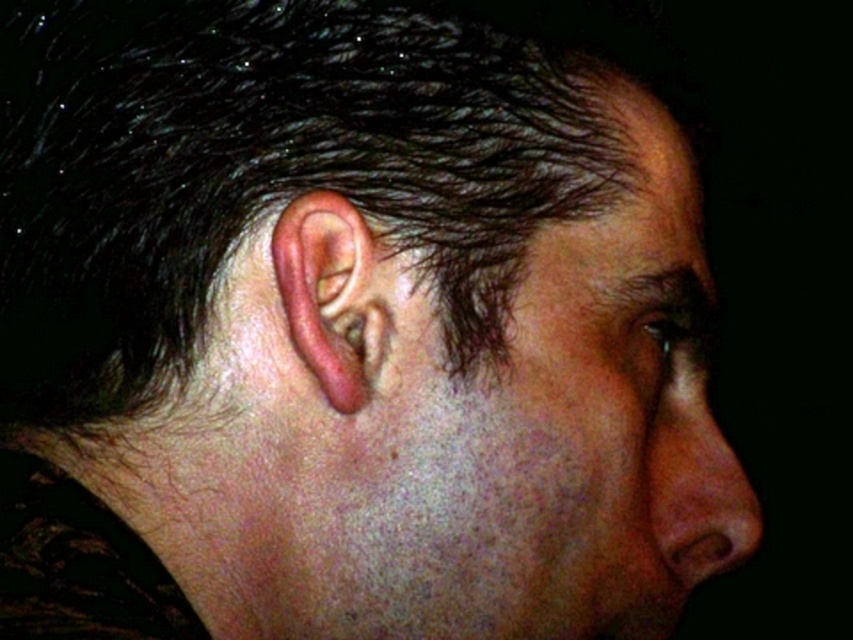
Question: Is pink flesh-colored ear at center to the right of matte pink nose at right from the viewer's perspective?

Choices:
 (A) yes
 (B) no

Answer: (B)

Question: Which object appears farthest from the camera in this image?

Choices:
 (A) pink flesh-colored ear at center
 (B) matte pink nose at right

Answer: (B)

Question: Which point is farther to the camera?

Choices:
 (A) pink flesh-colored ear at center
 (B) matte pink nose at right

Answer: (B)

Question: Does pink flesh-colored ear at center lie behind matte pink nose at right?

Choices:
 (A) yes
 (B) no

Answer: (B)

Question: Is pink flesh-colored ear at center positioned before matte pink nose at right?

Choices:
 (A) no
 (B) yes

Answer: (B)